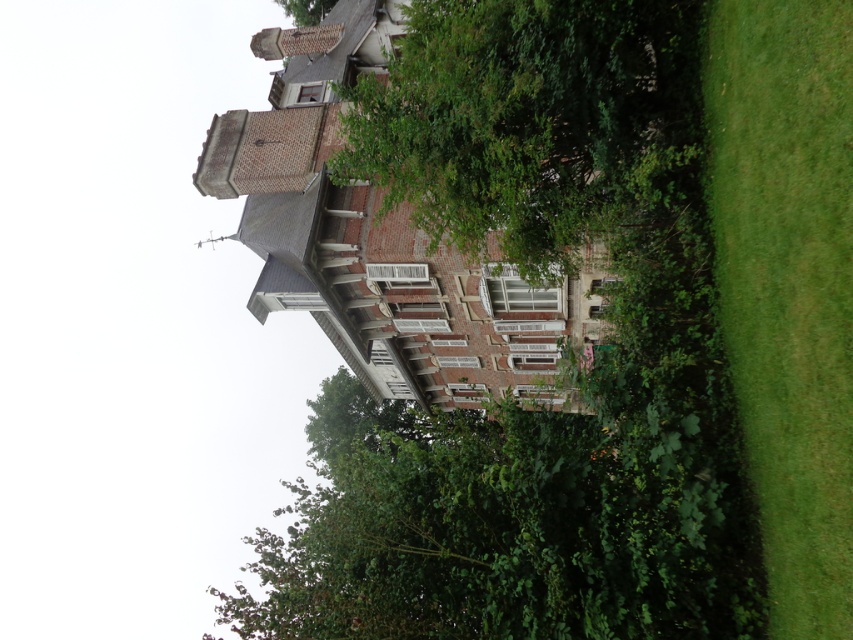
Who is taller, green leafy tree at center or green grass at right?

green grass at right

Describe the element at coordinates (541, 131) in the screenshot. I see `green leafy tree at center` at that location.

At what (x,y) coordinates should I click in order to perform the action: click on green leafy tree at center. Please return your answer as a coordinate pair (x, y). Looking at the image, I should click on (541, 131).